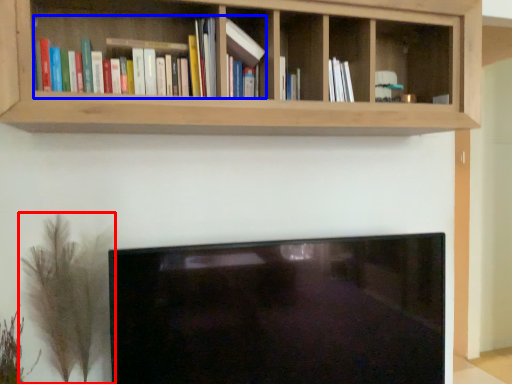
Question: Which of the following is the farthest to the observer, plant (highlighted by a red box) or book (highlighted by a blue box)?

Choices:
 (A) plant
 (B) book

Answer: (A)